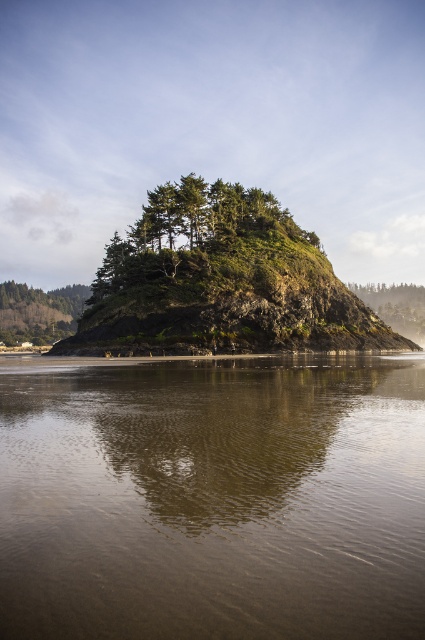
Question: Is the position of brown reflective water at center more distant than that of foggy mist at upper center?

Choices:
 (A) no
 (B) yes

Answer: (A)

Question: Can you confirm if brown reflective water at center is wider than green matte tree at left?

Choices:
 (A) yes
 (B) no

Answer: (B)

Question: Which object appears farthest from the camera in this image?

Choices:
 (A) green matte tree at left
 (B) brown reflective water at center
 (C) green textured rock at center

Answer: (A)

Question: Among these points, which one is farthest from the camera?

Choices:
 (A) (17, 579)
 (B) (300, 234)
 (C) (6, 296)
 (D) (19, 248)

Answer: (D)

Question: From the image, what is the correct spatial relationship of foggy mist at upper center in relation to green matte tree at left?

Choices:
 (A) below
 (B) above

Answer: (B)

Question: Estimate the real-world distances between objects in this image. Which object is closer to the brown reflective water at center?

Choices:
 (A) green textured rock at center
 (B) foggy mist at upper center

Answer: (A)